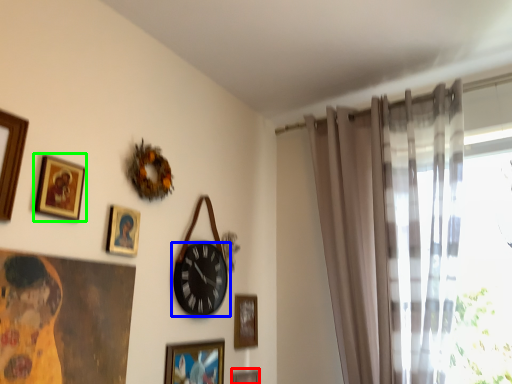
Question: Based on their relative distances, which object is nearer to picture frame (highlighted by a red box)? Choose from wall clock (highlighted by a blue box) and picture frame (highlighted by a green box).

Choices:
 (A) wall clock
 (B) picture frame

Answer: (A)